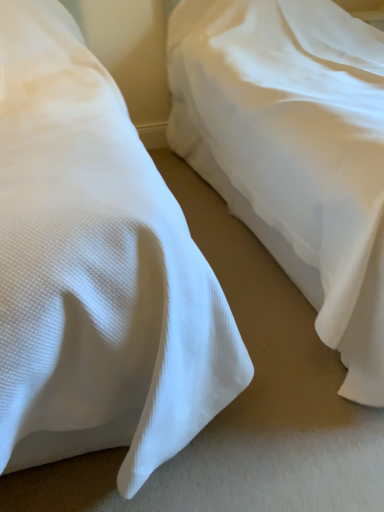
Question: Considering their positions, is white textured fabric at center, placed as the 2th bed when sorted from left to right, located in front of or behind white textured pillow at left, the second bed viewed from the right?

Choices:
 (A) behind
 (B) front

Answer: (A)

Question: From a real-world perspective, relative to white textured pillow at left, which appears as the 1th bed when viewed from the left, is white textured fabric at center, placed as the 2th bed when sorted from left to right, vertically above or below?

Choices:
 (A) below
 (B) above

Answer: (A)

Question: From the image's perspective, relative to white textured pillow at left, the second bed viewed from the right, is white textured fabric at center, placed as the 2th bed when sorted from left to right, above or below?

Choices:
 (A) above
 (B) below

Answer: (A)

Question: From a real-world perspective, relative to white textured fabric at center, the 1th bed from the right, is white textured pillow at left, which appears as the 1th bed when viewed from the left, vertically above or below?

Choices:
 (A) above
 (B) below

Answer: (A)

Question: Looking at the image, does white textured pillow at left, the second bed viewed from the right, seem bigger or smaller compared to white textured fabric at center, placed as the 2th bed when sorted from left to right?

Choices:
 (A) big
 (B) small

Answer: (B)

Question: Do you think white textured pillow at left, which appears as the 1th bed when viewed from the left, is within white textured fabric at center, the 1th bed from the right, or outside of it?

Choices:
 (A) inside
 (B) outside

Answer: (B)

Question: Considering the positions of white textured pillow at left, which appears as the 1th bed when viewed from the left, and white textured fabric at center, placed as the 2th bed when sorted from left to right, in the image, is white textured pillow at left, which appears as the 1th bed when viewed from the left, wider or thinner than white textured fabric at center, placed as the 2th bed when sorted from left to right,?

Choices:
 (A) wide
 (B) thin

Answer: (A)